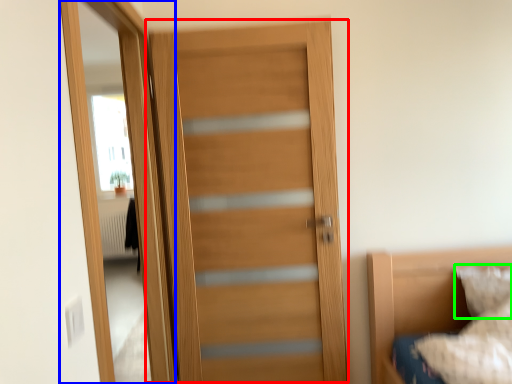
Question: Based on their relative distances, which object is nearer to door (highlighted by a red box)? Choose from screen door (highlighted by a blue box) and pillow (highlighted by a green box).

Choices:
 (A) screen door
 (B) pillow

Answer: (A)